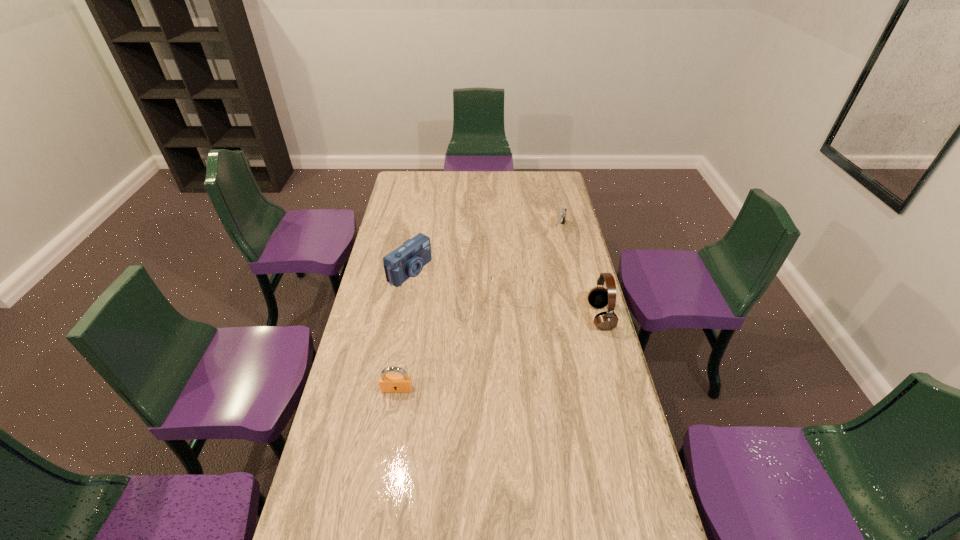
Identify the location of camera that is at the left edge. The height and width of the screenshot is (540, 960). (406, 261).

This screenshot has width=960, height=540. Identify the location of headset present at the right edge. [x=598, y=297].

Where is `gun that is at the right edge`? The image size is (960, 540). gun that is at the right edge is located at coordinates (562, 214).

You are a GUI agent. You are given a task and a screenshot of the screen. Output one action in this format:
    pyautogui.click(x=<x>, y=<y>)
    Task: Click on the vacant space at the far edge
    This screenshot has width=960, height=540.
    Given the screenshot: What is the action you would take?
    pyautogui.click(x=475, y=172)

The image size is (960, 540). In order to click on free space at the near edge in this screenshot , I will do `click(379, 530)`.

Locate an element on the screen. blank space at the left edge of the desktop is located at coordinates (367, 333).

Where is `vacant region at the right edge`? vacant region at the right edge is located at coordinates (577, 394).

The width and height of the screenshot is (960, 540). In the image, there is a desktop. What are the coordinates of `vacant space at the far left corner` in the screenshot? It's located at (427, 176).

You are a GUI agent. You are given a task and a screenshot of the screen. Output one action in this format:
    pyautogui.click(x=<x>, y=<y>)
    Task: Click on the blank region between the spectacles and the gun
    The width and height of the screenshot is (960, 540).
    Given the screenshot: What is the action you would take?
    pyautogui.click(x=536, y=261)

Find the location of `empty space that is in between the third object from left to right and the nearest object`. empty space that is in between the third object from left to right and the nearest object is located at coordinates (454, 340).